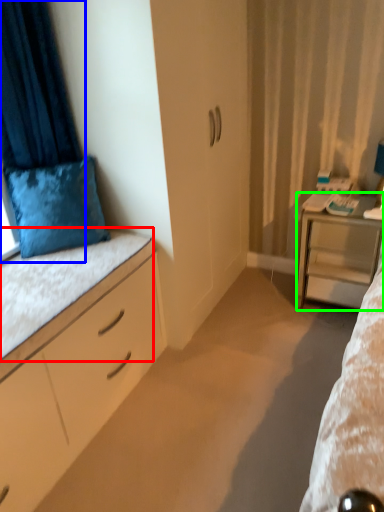
Question: Which object is positioned farthest from ledge (highlighted by a red box)? Select from curtain (highlighted by a blue box) and desk (highlighted by a green box).

Choices:
 (A) curtain
 (B) desk

Answer: (B)